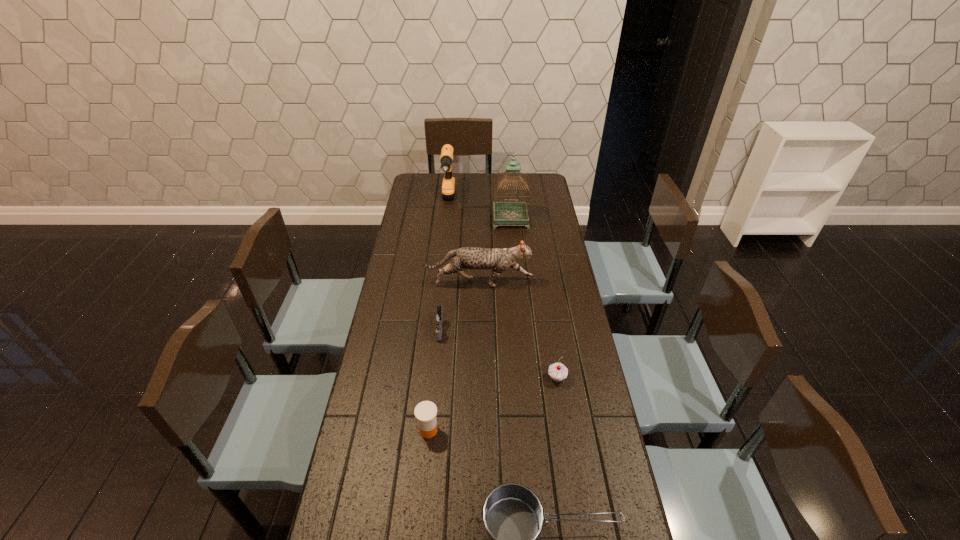
Identify the location of the fourth closest object relative to the drill. (557, 371).

You are a GUI agent. You are given a task and a screenshot of the screen. Output one action in this format:
    pyautogui.click(x=<x>, y=<y>)
    Task: Click on the sixth closest object to the birdcage
    
    Given the screenshot: What is the action you would take?
    pyautogui.click(x=513, y=516)

Find the location of `vacant space that satisfies the following two spatial constraints: 1. at the door of the cupcake; 2. on the right side of the tallest object`. vacant space that satisfies the following two spatial constraints: 1. at the door of the cupcake; 2. on the right side of the tallest object is located at coordinates (525, 378).

What are the coordinates of `free point that satisfies the following two spatial constraints: 1. at the tip of the cupcake; 2. on the right side of the sixth shortest object` in the screenshot? It's located at (430, 378).

Locate an element on the screen. Image resolution: width=960 pixels, height=540 pixels. vacant area that satisfies the following two spatial constraints: 1. on the face of the third farthest object; 2. on the right side of the fifth farthest object is located at coordinates (478, 378).